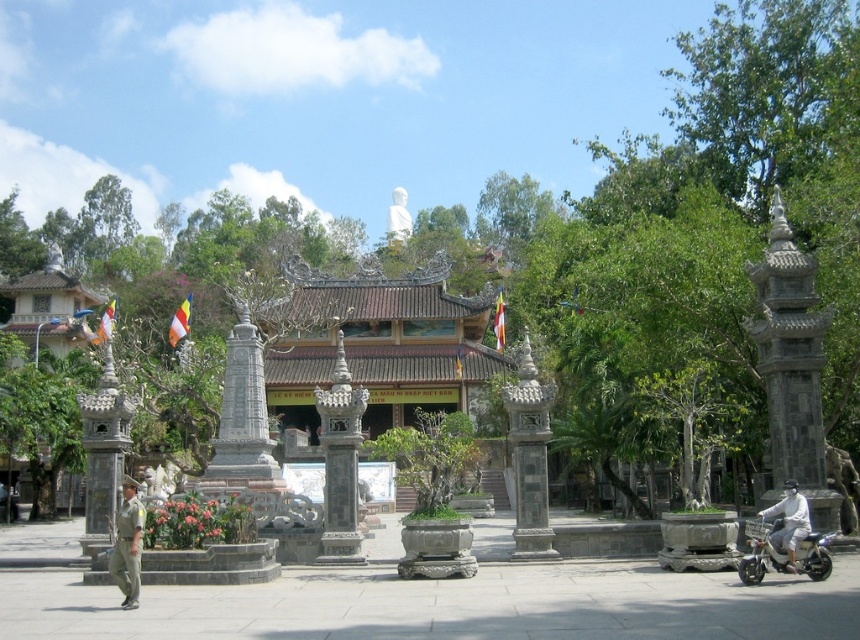
Question: Does metallic silver scooter at lower right appear on the right side of khaki uniform at lower left?

Choices:
 (A) no
 (B) yes

Answer: (B)

Question: Does brown wooden palace at center appear on the right side of white matte scooter at lower right?

Choices:
 (A) no
 (B) yes

Answer: (A)

Question: Which object is closer to the camera taking this photo?

Choices:
 (A) metallic silver scooter at lower right
 (B) white matte scooter at lower right

Answer: (B)

Question: Based on their relative distances, which object is farther from the khaki uniform at lower left?

Choices:
 (A) white matte scooter at lower right
 (B) brown wooden palace at center
 (C) metallic silver scooter at lower right

Answer: (B)

Question: Does brown wooden palace at center appear under white matte scooter at lower right?

Choices:
 (A) yes
 (B) no

Answer: (B)

Question: Which point appears closest to the camera in this image?

Choices:
 (A) (133, 596)
 (B) (440, 326)

Answer: (A)